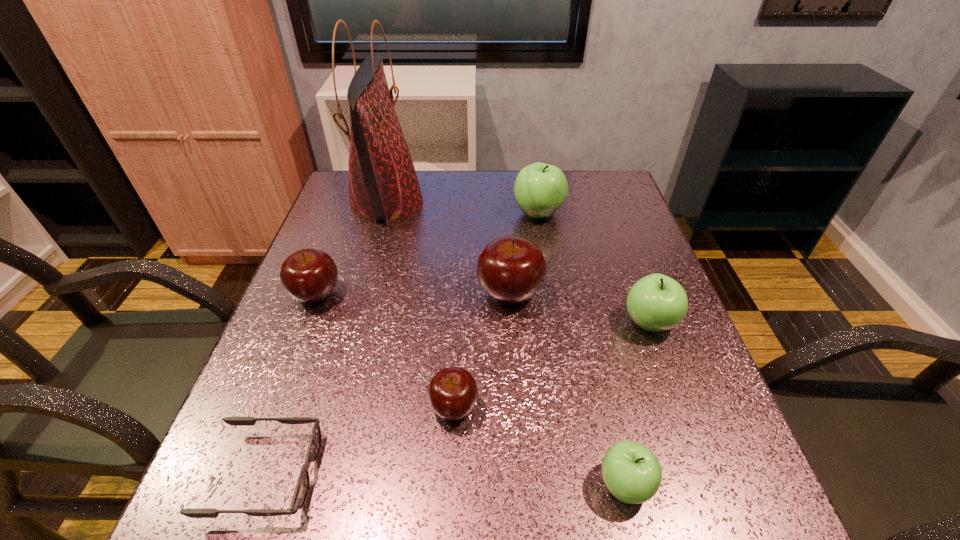
This screenshot has height=540, width=960. Identify the location of the smallest green apple. 632,473.

Identify the location of the nearest green apple. The image size is (960, 540). (632, 473).

The image size is (960, 540). I want to click on the shortest object, so click(301, 490).

Image resolution: width=960 pixels, height=540 pixels. Find the location of `vacant space situated 0.110m on the front of the handbag`. vacant space situated 0.110m on the front of the handbag is located at coordinates (370, 265).

This screenshot has width=960, height=540. Identify the location of free location located 0.400m on the front of the biggest green apple. (562, 351).

At what (x,y) coordinates should I click in order to perform the action: click on free location located on the front of the biggest red apple. Please return your answer as a coordinate pair (x, y). This screenshot has width=960, height=540. Looking at the image, I should click on (523, 494).

Find the location of a particular element. free location located 0.350m on the right of the second biggest red apple is located at coordinates (499, 294).

The image size is (960, 540). Identify the location of vacant region located on the front of the rightmost object. (704, 469).

The height and width of the screenshot is (540, 960). What are the coordinates of `vacant space situated 0.070m on the right of the smallest red apple` in the screenshot? It's located at (518, 407).

I want to click on vacant region located on the back of the nearest green apple, so click(584, 308).